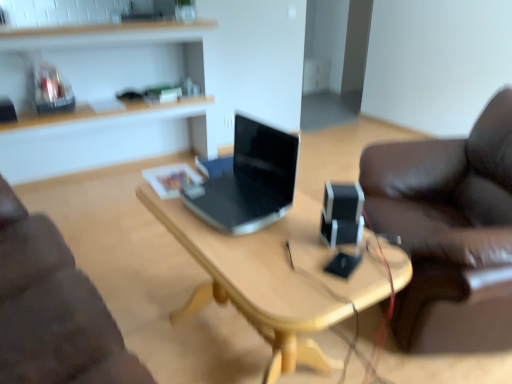
Find the location of a particular element. space that is in front of sleek black laptop at center is located at coordinates (262, 264).